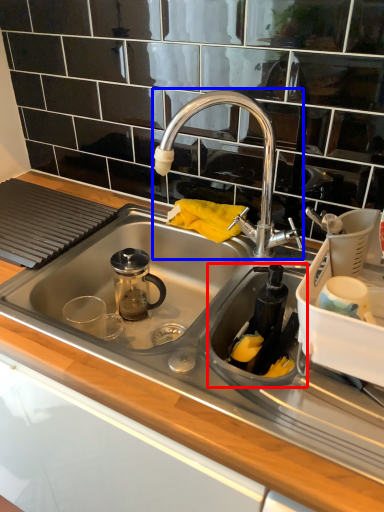
Question: Which object appears farthest to the camera in this image, appliance (highlighted by a red box) or tap (highlighted by a blue box)?

Choices:
 (A) appliance
 (B) tap

Answer: (B)